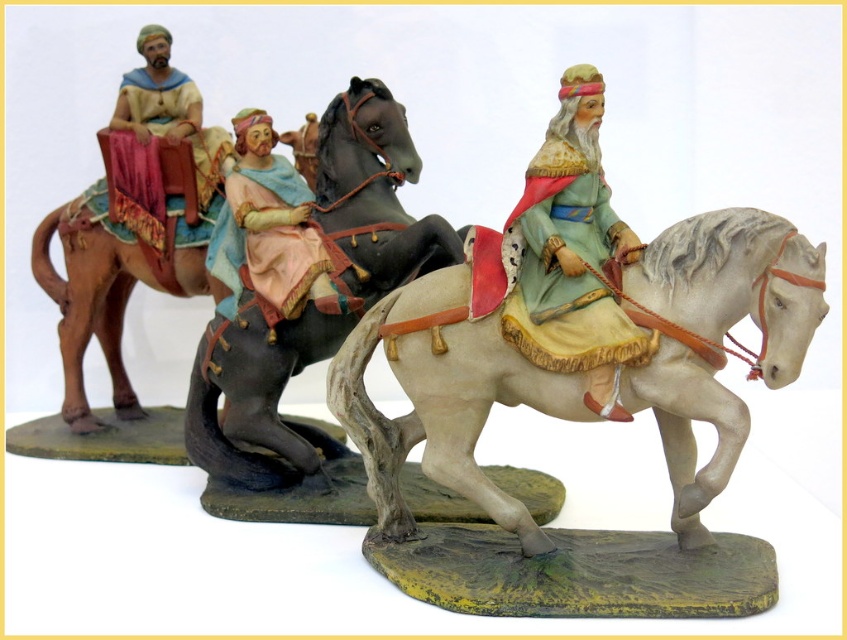
Question: Can you confirm if white matte horse at center is wider than shiny black horse at center?

Choices:
 (A) no
 (B) yes

Answer: (B)

Question: Does white matte horse at center have a greater width compared to matte plastic figure at center?

Choices:
 (A) no
 (B) yes

Answer: (B)

Question: Among these points, which one is nearest to the camera?

Choices:
 (A) (294, 259)
 (B) (499, 401)
 (C) (197, 109)

Answer: (B)

Question: Which of the following is the closest to the observer?

Choices:
 (A) white matte horse at center
 (B) matte plastic figure at center
 (C) matte brown fabric at left
 (D) porcelain figure at center

Answer: (A)

Question: Which of the following is the closest to the observer?

Choices:
 (A) matte brown fabric at left
 (B) white matte horse at center
 (C) porcelain figure at center

Answer: (B)

Question: Is white matte horse at center to the right of shiny black horse at center from the viewer's perspective?

Choices:
 (A) no
 (B) yes

Answer: (B)